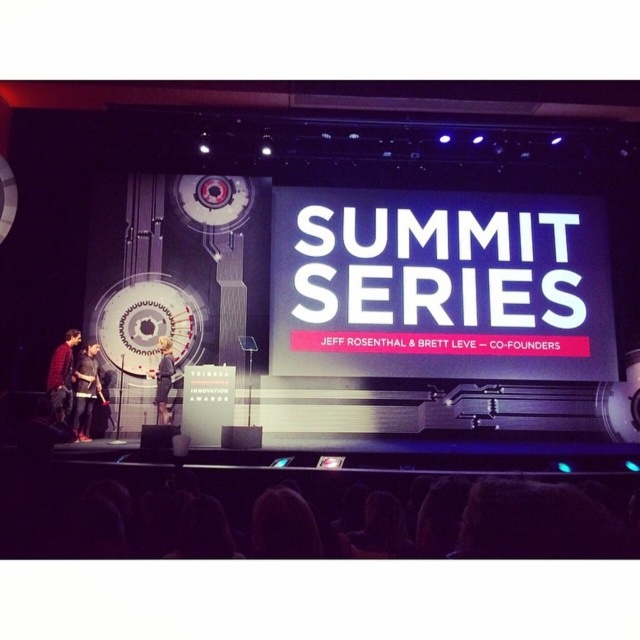
Does dark gray fabric jacket at left appear on the right side of matte black jacket at left?

Correct, you'll find dark gray fabric jacket at left to the right of matte black jacket at left.

Between dark gray fabric jacket at left and matte black jacket at left, which one is positioned lower?

dark gray fabric jacket at left is lower down.

You are a GUI agent. You are given a task and a screenshot of the screen. Output one action in this format:
    pyautogui.click(x=<x>, y=<y>)
    Task: Click on the dark gray fabric jacket at left
    This screenshot has height=640, width=640.
    Given the screenshot: What is the action you would take?
    click(84, 392)

Which is more to the left, matte black jacket at left or light brown leather jacket at center?

matte black jacket at left is more to the left.

Describe the element at coordinates (61, 376) in the screenshot. This screenshot has width=640, height=640. I see `matte black jacket at left` at that location.

What do you see at coordinates (61, 376) in the screenshot? I see `matte black jacket at left` at bounding box center [61, 376].

At what (x,y) coordinates should I click in order to perform the action: click on matte black jacket at left. Please return your answer as a coordinate pair (x, y). This screenshot has height=640, width=640. Looking at the image, I should click on (61, 376).

From the picture: Which of these two, dark gray fabric jacket at left or light brown leather jacket at center, stands taller?

dark gray fabric jacket at left

Between point (81, 369) and point (161, 352), which one is positioned in front?

Positioned in front is point (81, 369).

Locate an element on the screen. The image size is (640, 640). dark gray fabric jacket at left is located at coordinates (84, 392).